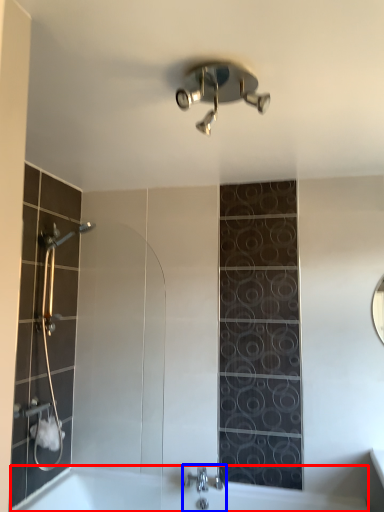
Question: Which object appears farthest to the camera in this image, bath (highlighted by a red box) or tap (highlighted by a blue box)?

Choices:
 (A) bath
 (B) tap

Answer: (B)